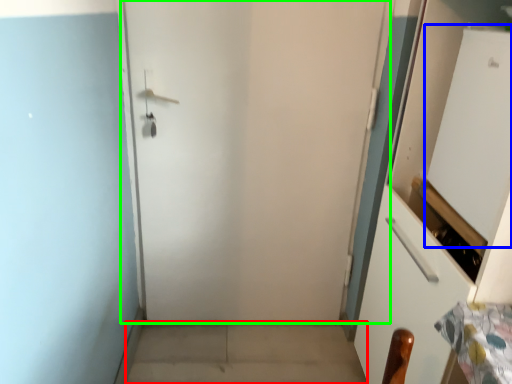
Question: Which object is positioned farthest from concrete (highlighted by a red box)? Select from screen door (highlighted by a blue box) and door (highlighted by a green box).

Choices:
 (A) screen door
 (B) door

Answer: (A)